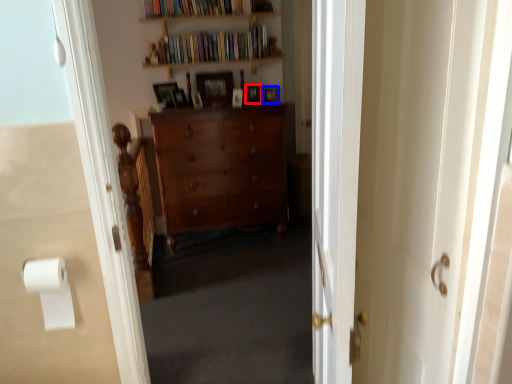
Question: Which object appears closest to the camera in this image, picture frame (highlighted by a red box) or picture frame (highlighted by a blue box)?

Choices:
 (A) picture frame
 (B) picture frame

Answer: (B)